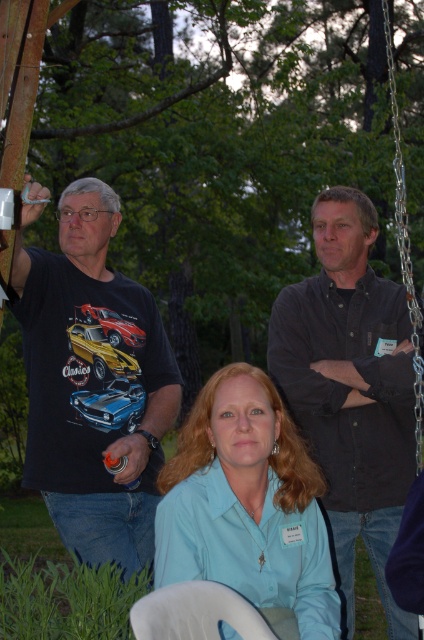
Which of these two, black cotton t-shirt at left or light blue shirt at center, stands shorter?

light blue shirt at center is shorter.

Is point (142, 509) positioned after point (286, 424)?

Yes.

The width and height of the screenshot is (424, 640). What are the coordinates of `black cotton t-shirt at left` in the screenshot? It's located at (91, 381).

In order to click on black cotton t-shirt at left in this screenshot , I will do `click(91, 381)`.

Can you confirm if black cotton t-shirt at left is thinner than dark gray shirt at upper right?

Yes, black cotton t-shirt at left is thinner than dark gray shirt at upper right.

This screenshot has width=424, height=640. In order to click on black cotton t-shirt at left in this screenshot , I will do [x=91, y=381].

Which is behind, point (33, 284) or point (368, 372)?

Positioned behind is point (368, 372).

Where is `black cotton t-shirt at left`? The image size is (424, 640). black cotton t-shirt at left is located at coordinates (91, 381).

Which is behind, point (282, 346) or point (251, 456)?

Positioned behind is point (282, 346).

Locate an element on the screen. This screenshot has width=424, height=640. dark gray shirt at upper right is located at coordinates (351, 390).

Does point (351, 580) come behind point (259, 404)?

Yes, it is.

Locate an element on the screen. dark gray shirt at upper right is located at coordinates (351, 390).